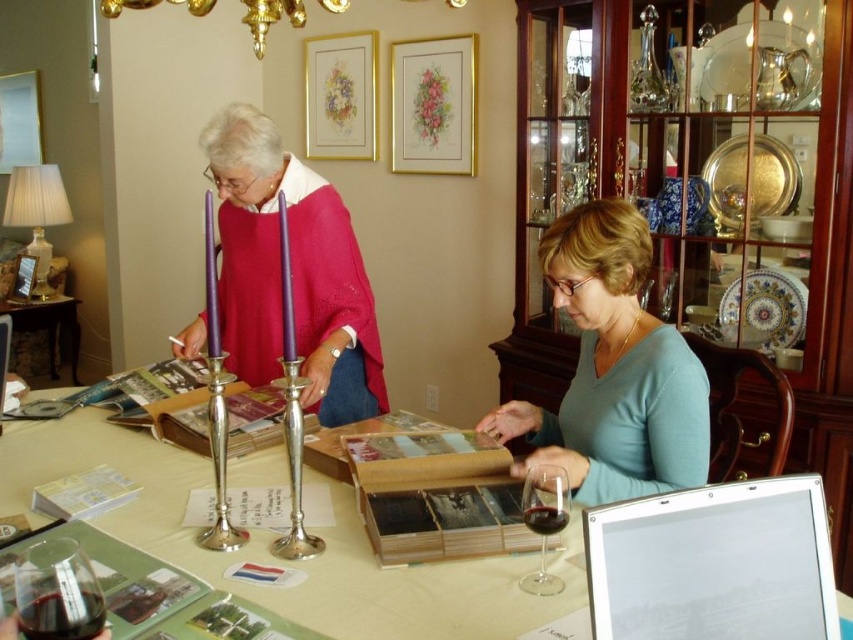
Question: Which object is positioned closest to the transparent glass wine glass at lower center?

Choices:
 (A) white paper at center
 (B) white glossy tablet at lower right
 (C) pink sweater at center
 (D) dark red liquid at lower left

Answer: (B)

Question: Is white glossy tablet at lower right bigger than dark red liquid at lower left?

Choices:
 (A) yes
 (B) no

Answer: (A)

Question: Is white glossy tablet at lower right to the left of transparent glass wine glass at lower center from the viewer's perspective?

Choices:
 (A) no
 (B) yes

Answer: (A)

Question: Estimate the real-world distances between objects in this image. Which object is closer to the translucent glass wine glass at lower left?

Choices:
 (A) blue matte shirt at center
 (B) transparent glass wine glass at lower center

Answer: (B)

Question: Which point is closer to the camera?

Choices:
 (A) (250, 256)
 (B) (24, 618)

Answer: (B)

Question: Can you confirm if matte pink sweater at center is positioned below translucent glass wine glass at lower left?

Choices:
 (A) no
 (B) yes

Answer: (A)